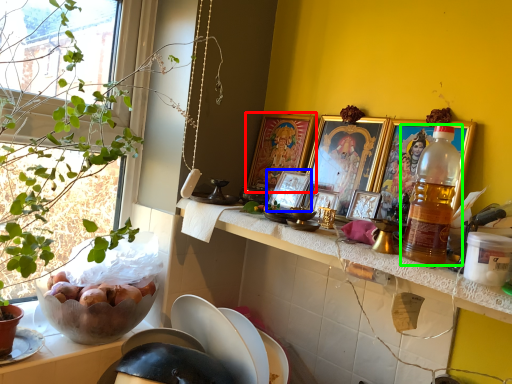
Question: Estimate the real-world distances between objects in this image. Which object is closer to picture frame (highlighted by a red box), picture frame (highlighted by a blue box) or bottle (highlighted by a green box)?

Choices:
 (A) picture frame
 (B) bottle

Answer: (A)